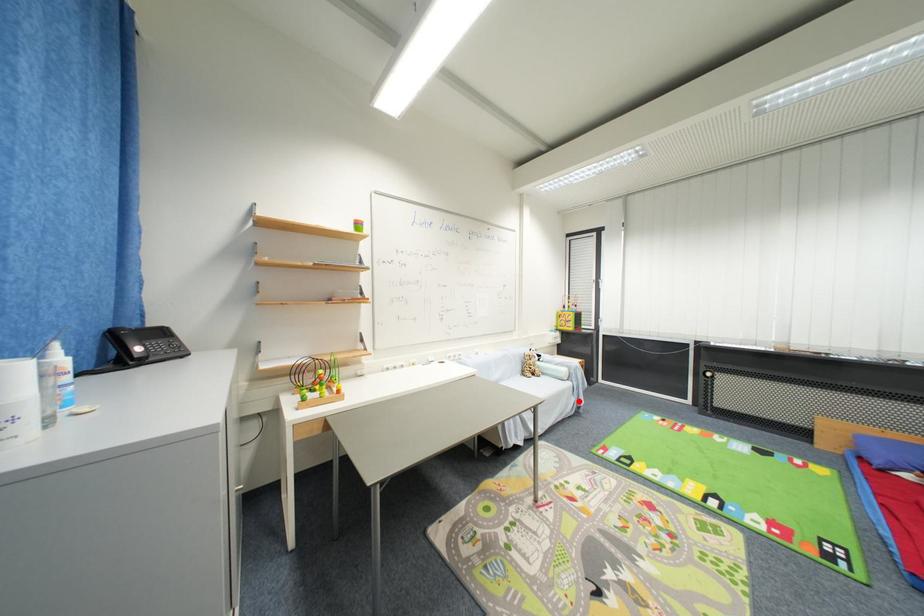
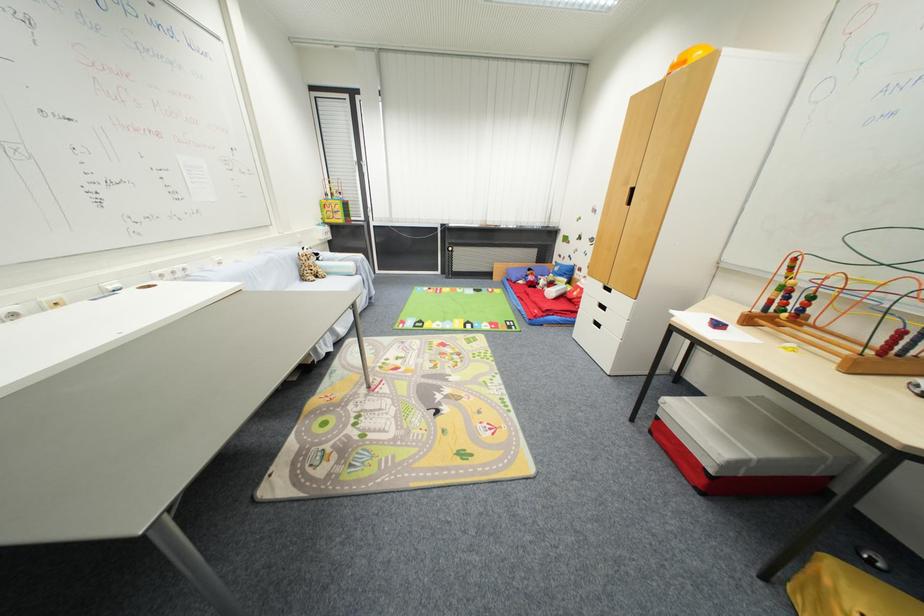
Question: I am providing you with two images of the same scene from different viewpoints. Image1 has a red point marked. In image2, the corresponding 3D location appears at what relative position? Reply with the corresponding letter.

Choices:
 (A) Closer
 (B) Farther

Answer: (A)